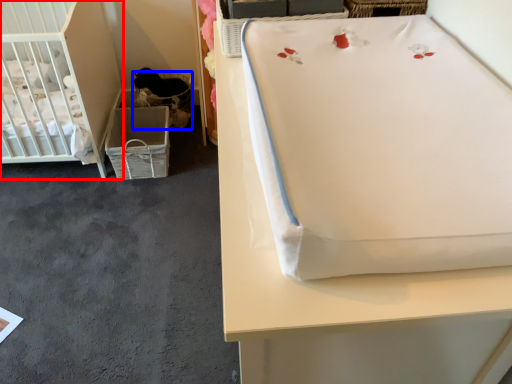
Question: Which point is closer to the camera, infant bed (highlighted by a red box) or basket (highlighted by a blue box)?

Choices:
 (A) infant bed
 (B) basket

Answer: (A)